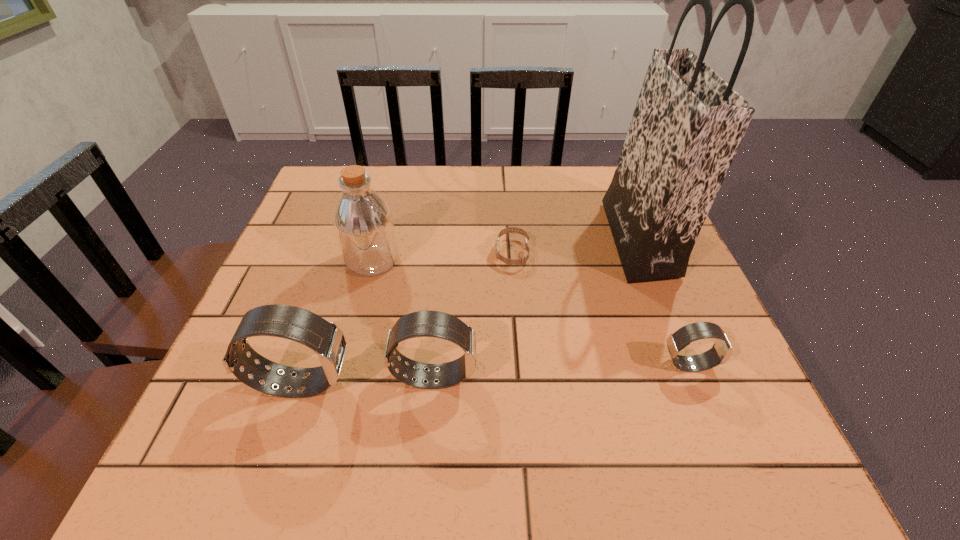
Locate an element on the screen. free region located on the face of the third shortest object is located at coordinates tap(700, 376).

The height and width of the screenshot is (540, 960). I want to click on vacant region located 0.310m on the face of the shortest watch, so click(363, 253).

In order to click on free space located on the face of the shortest watch in this screenshot , I will do `click(448, 253)`.

At what (x,y) coordinates should I click in order to perform the action: click on free region located on the face of the shortest watch. Please return your answer as a coordinate pair (x, y). The image size is (960, 540). Looking at the image, I should click on (342, 253).

Image resolution: width=960 pixels, height=540 pixels. Find the location of `vacant position located 0.190m on the front of the tallest object with the design`. vacant position located 0.190m on the front of the tallest object with the design is located at coordinates (534, 239).

This screenshot has width=960, height=540. What are the coordinates of `vacant area situated on the front of the tallest object with the design` in the screenshot? It's located at (559, 239).

Locate an element on the screen. The height and width of the screenshot is (540, 960). vacant region located 0.320m on the front of the tallest object with the design is located at coordinates (480, 239).

You are a GUI agent. You are given a task and a screenshot of the screen. Output one action in this format:
    pyautogui.click(x=<x>, y=<y>)
    Task: Click on the vacant space located on the right of the second tallest object
    Image resolution: width=960 pixels, height=540 pixels.
    Given the screenshot: What is the action you would take?
    pyautogui.click(x=491, y=260)

The image size is (960, 540). Identify the location of object that is at the far edge. (688, 123).

Image resolution: width=960 pixels, height=540 pixels. I want to click on watch at the left edge, so click(x=325, y=338).